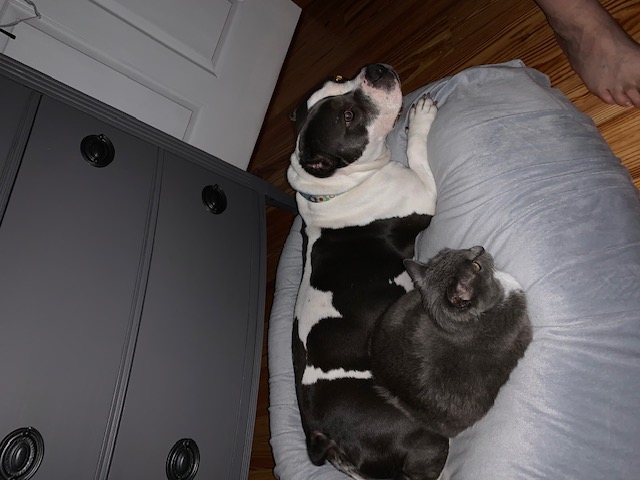
The width and height of the screenshot is (640, 480). What are the coordinates of `door` in the screenshot? It's located at (550, 166).